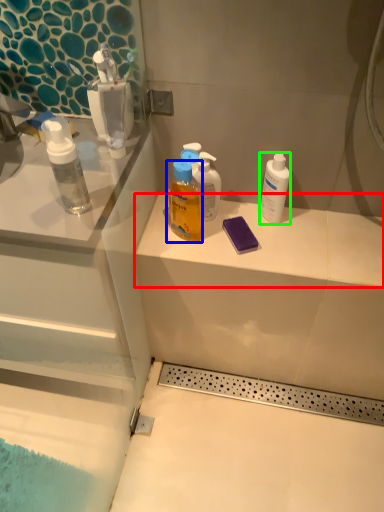
Question: Which object is positioned farthest from counter top (highlighted by a red box)? Select from bottle (highlighted by a blue box) and mouthwash (highlighted by a green box).

Choices:
 (A) bottle
 (B) mouthwash

Answer: (A)